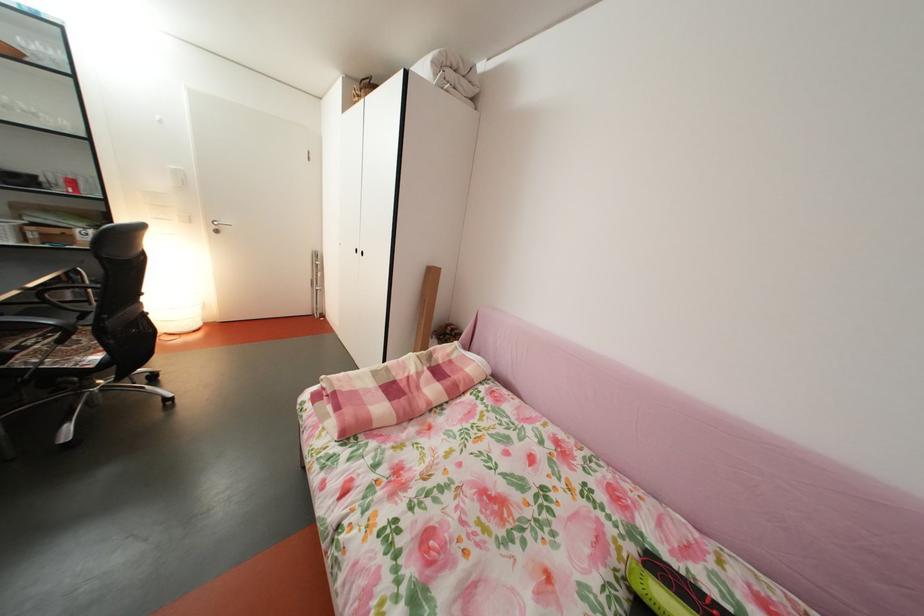
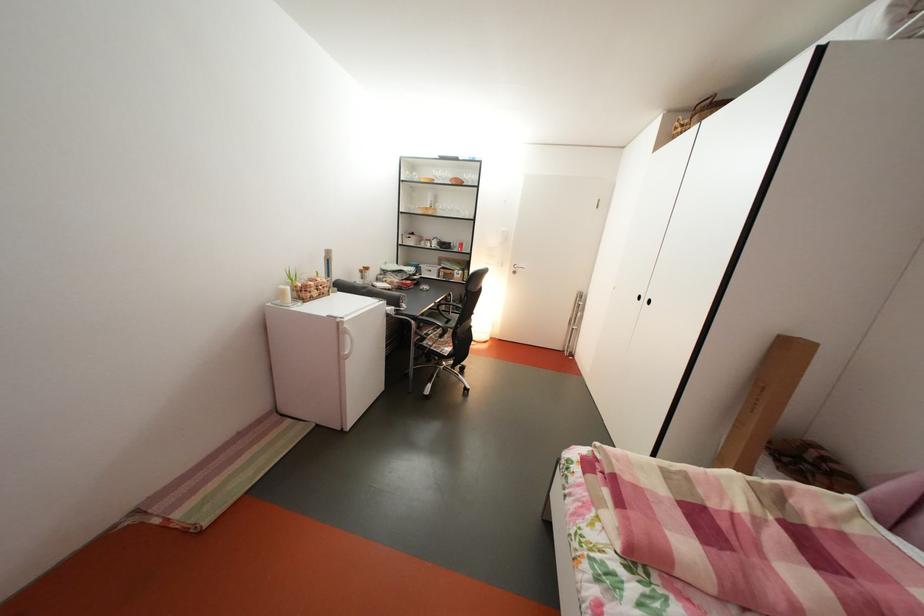
Question: Based on the continuous images, in which direction is the camera rotating? Reply with the corresponding letter.

Choices:
 (A) Left
 (B) Right
 (C) Up
 (D) Down

Answer: (A)